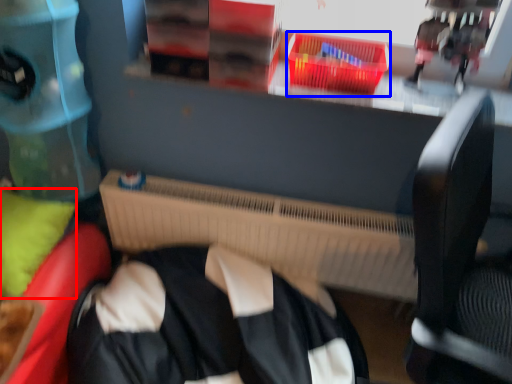
Question: Which object appears closest to the camera in this image, pillow (highlighted by a red box) or basket (highlighted by a blue box)?

Choices:
 (A) pillow
 (B) basket

Answer: (A)